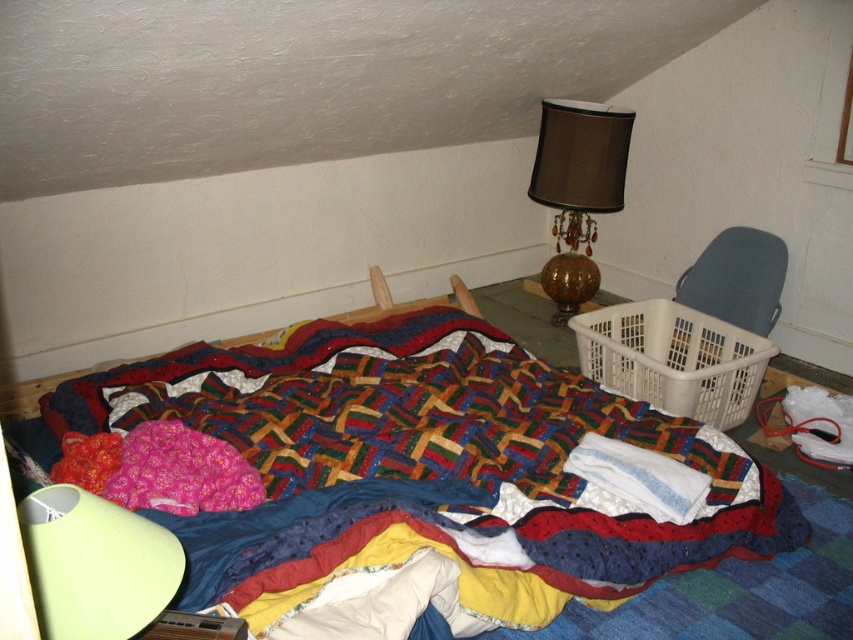
Question: In this image, where is multicolored quilt at center located relative to light green fabric lampshade at lower left?

Choices:
 (A) below
 (B) above

Answer: (A)

Question: Where is light green fabric lampshade at lower left located in relation to brown glossy lampshade at upper right in the image?

Choices:
 (A) above
 (B) below

Answer: (B)

Question: Which of the following is the farthest from the observer?

Choices:
 (A) (440, 541)
 (B) (614, 150)
 (C) (755, 272)

Answer: (B)

Question: Which point is farther from the camera taking this photo?

Choices:
 (A) (80, 515)
 (B) (621, 326)

Answer: (B)

Question: Can you confirm if brown glossy lampshade at upper right is positioned to the right of gray plastic laundry basket at right?

Choices:
 (A) yes
 (B) no

Answer: (B)

Question: Among these points, which one is nearest to the camera?

Choices:
 (A) (78, 522)
 (B) (210, 378)
 (C) (708, 275)

Answer: (A)